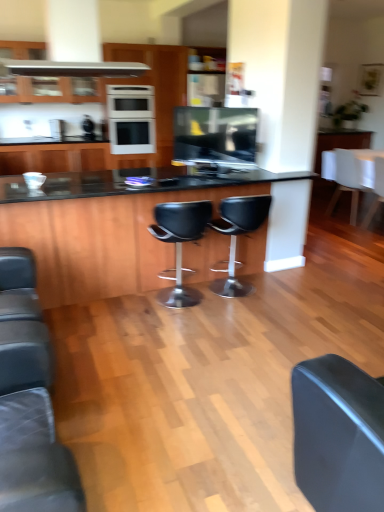
Question: Considering the positions of white matte counter top at right and black leather stool at center, marked as the second chair in a left-to-right arrangement, in the image, is white matte counter top at right taller or shorter than black leather stool at center, marked as the second chair in a left-to-right arrangement,?

Choices:
 (A) tall
 (B) short

Answer: (B)

Question: Relative to black leather stool at center, the second chair in the front-to-back sequence, is white matte counter top at right in front or behind?

Choices:
 (A) front
 (B) behind

Answer: (B)

Question: Which object is positioned farthest from the white matte counter top at right?

Choices:
 (A) white matte chair at right, the first chair in the back-to-front sequence
 (B) white fabric chair at right, arranged as the 3th chair when viewed from the front
 (C) white glossy oven at upper center
 (D) white glossy oven at center
 (E) black leather stool at center, marked as the second chair in a left-to-right arrangement

Answer: (E)

Question: Considering the real-world distances, which object is closest to the white matte chair at right, acting as the 2th chair starting from the right?

Choices:
 (A) white glossy oven at center
 (B) white matte counter top at right
 (C) white fabric chair at right, which ranks as the 1th chair in right-to-left order
 (D) black leather stool at center, the 3th chair from the right
 (E) flat screen tv at center

Answer: (B)